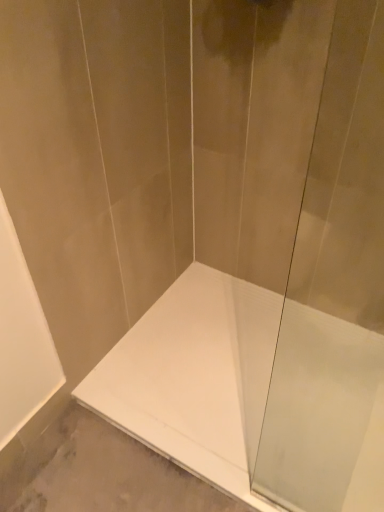
Question: Can white glossy bathtub at center be found inside transparent glass shower door at center?

Choices:
 (A) yes
 (B) no

Answer: (B)

Question: Is transparent glass shower door at center facing away from white glossy bathtub at center?

Choices:
 (A) yes
 (B) no

Answer: (B)

Question: From a real-world perspective, is transparent glass shower door at center positioned over white glossy bathtub at center based on gravity?

Choices:
 (A) no
 (B) yes

Answer: (B)

Question: Does transparent glass shower door at center touch white glossy bathtub at center?

Choices:
 (A) no
 (B) yes

Answer: (A)

Question: From a real-world perspective, is transparent glass shower door at center positioned under white glossy bathtub at center based on gravity?

Choices:
 (A) no
 (B) yes

Answer: (A)

Question: From the image's perspective, is transparent glass shower door at center located above white glossy bathtub at center?

Choices:
 (A) yes
 (B) no

Answer: (A)

Question: From a real-world perspective, is white glossy bathtub at center beneath transparent glass shower door at center?

Choices:
 (A) no
 (B) yes

Answer: (B)

Question: Does white glossy bathtub at center contain transparent glass shower door at center?

Choices:
 (A) no
 (B) yes

Answer: (A)

Question: Can you confirm if white glossy bathtub at center is bigger than transparent glass shower door at center?

Choices:
 (A) yes
 (B) no

Answer: (A)

Question: Does white glossy bathtub at center come behind transparent glass shower door at center?

Choices:
 (A) yes
 (B) no

Answer: (A)

Question: Is white glossy bathtub at center aimed at transparent glass shower door at center?

Choices:
 (A) no
 (B) yes

Answer: (A)

Question: From the image's perspective, is white glossy bathtub at center below transparent glass shower door at center?

Choices:
 (A) yes
 (B) no

Answer: (A)

Question: Is transparent glass shower door at center in front of or behind white glossy bathtub at center in the image?

Choices:
 (A) front
 (B) behind

Answer: (A)